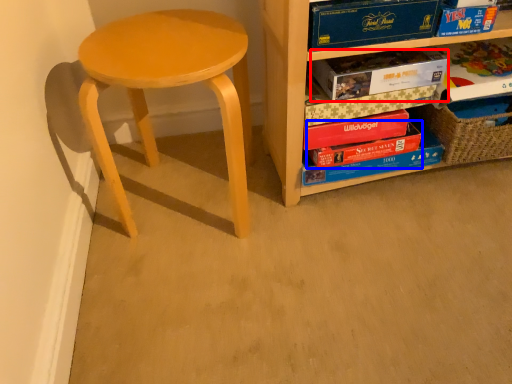
Question: Which point is further to the camera, paperback book (highlighted by a red box) or paperback book (highlighted by a blue box)?

Choices:
 (A) paperback book
 (B) paperback book

Answer: (B)